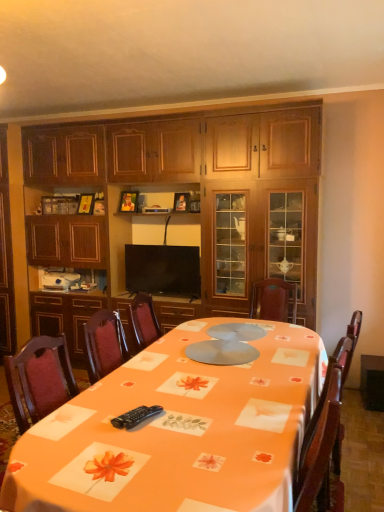
This screenshot has height=512, width=384. Identify the location of orange fabric table at center. (179, 429).

Where is `wooden cabinet at center`? Image resolution: width=384 pixels, height=512 pixels. wooden cabinet at center is located at coordinates (210, 186).

Does black plastic remote control at lower center have a smaller size compared to flat screen tv at center?

Correct, black plastic remote control at lower center occupies less space than flat screen tv at center.

From a real-world perspective, between black plastic remote control at lower center and flat screen tv at center, who is vertically higher?

flat screen tv at center.

Between black plastic remote control at lower center and flat screen tv at center, which one appears on the right side from the viewer's perspective?

From the viewer's perspective, black plastic remote control at lower center appears more on the right side.

Measure the distance from black plastic remote control at lower center to flat screen tv at center.

black plastic remote control at lower center is 7.05 feet away from flat screen tv at center.

Can you confirm if orange fabric table at center is thinner than wooden cabinet at center?

No.

From a real-world perspective, is orange fabric table at center under wooden cabinet at center?

Yes, from a real-world perspective, orange fabric table at center is under wooden cabinet at center.

From the image's perspective, which one is positioned higher, orange fabric table at center or wooden cabinet at center?

wooden cabinet at center is shown above in the image.

Is the depth of black plastic remote control at lower center greater than that of orange fabric table at center?

Yes, black plastic remote control at lower center is further from the camera.

Can orange fabric table at center be found inside black plastic remote control at lower center?

No, black plastic remote control at lower center does not contain orange fabric table at center.

Considering the sizes of black plastic remote control at lower center and orange fabric table at center in the image, is black plastic remote control at lower center taller or shorter than orange fabric table at center?

Considering their sizes, black plastic remote control at lower center has less height than orange fabric table at center.

From the image's perspective, which one is positioned lower, wooden cabinet at center or black plastic remote control at lower center?

black plastic remote control at lower center is shown below in the image.

Would you say wooden cabinet at center is a long distance from black plastic remote control at lower center?

wooden cabinet at center is far away from black plastic remote control at lower center.

From a real-world perspective, is wooden cabinet at center physically located above or below black plastic remote control at lower center?

From a real-world perspective, wooden cabinet at center is physically above black plastic remote control at lower center.

Considering the relative sizes of wooden cabinet at center and black plastic remote control at lower center in the image provided, is wooden cabinet at center wider than black plastic remote control at lower center?

Yes, wooden cabinet at center is wider than black plastic remote control at lower center.

Is black plastic remote control at lower center directly adjacent to wooden cabinet at center?

No, black plastic remote control at lower center is not next to wooden cabinet at center.

From a real-world perspective, between black plastic remote control at lower center and wooden cabinet at center, who is vertically higher?

wooden cabinet at center, from a real-world perspective.

Which object is wider, black plastic remote control at lower center or wooden cabinet at center?

wooden cabinet at center is wider.

Which object is positioned more to the right, black plastic remote control at lower center or wooden cabinet at center?

black plastic remote control at lower center.

Is point (245, 204) farther from viewer compared to point (188, 272)?

No, (245, 204) is in front of (188, 272).

Does wooden cabinet at center have a lesser height compared to flat screen tv at center?

No, wooden cabinet at center is not shorter than flat screen tv at center.

Would you consider wooden cabinet at center to be distant from flat screen tv at center?

No, wooden cabinet at center is not far away from flat screen tv at center.

From the image's perspective, which is below, wooden cabinet at center or flat screen tv at center?

flat screen tv at center is shown below in the image.

How many degrees apart are the facing directions of flat screen tv at center and orange fabric table at center?

86.6 degrees separate the facing orientations of flat screen tv at center and orange fabric table at center.

Between flat screen tv at center and orange fabric table at center, which one has larger width?

Wider between the two is orange fabric table at center.

Is flat screen tv at center smaller than orange fabric table at center?

Yes.

Which object is positioned more to the right, flat screen tv at center or orange fabric table at center?

Positioned to the right is orange fabric table at center.

Identify the location of remote control in front of the flat screen tv at center. The image size is (384, 512). (135, 416).

Identify the location of round table below the wooden cabinet at center (from a real-world perspective). pyautogui.click(x=179, y=429).

Based on their spatial positions, is black plastic remote control at lower center or flat screen tv at center closer to orange fabric table at center?

The object closer to orange fabric table at center is black plastic remote control at lower center.

Estimate the real-world distances between objects in this image. Which object is closer to flat screen tv at center, orange fabric table at center or wooden cabinet at center?

The object closer to flat screen tv at center is wooden cabinet at center.

When comparing their distances from orange fabric table at center, does flat screen tv at center or black plastic remote control at lower center seem closer?

black plastic remote control at lower center.

From the image, which object appears to be farther from black plastic remote control at lower center, wooden cabinet at center or orange fabric table at center?

The object further to black plastic remote control at lower center is wooden cabinet at center.

Which object lies nearer to the anchor point flat screen tv at center, orange fabric table at center or black plastic remote control at lower center?

Among the two, orange fabric table at center is located nearer to flat screen tv at center.

When comparing their distances from black plastic remote control at lower center, does orange fabric table at center or flat screen tv at center seem closer?

The object closer to black plastic remote control at lower center is orange fabric table at center.

When comparing their distances from orange fabric table at center, does wooden cabinet at center or black plastic remote control at lower center seem further?

wooden cabinet at center.

Looking at the image, which one is located further to wooden cabinet at center, flat screen tv at center or black plastic remote control at lower center?

black plastic remote control at lower center is further to wooden cabinet at center.

Find the location of a particular element. Image resolution: width=384 pixels, height=512 pixels. remote control positioned between orange fabric table at center and flat screen tv at center from near to far is located at coordinates (135, 416).

The image size is (384, 512). Find the location of `remote control positioned between orange fabric table at center and wooden cabinet at center from near to far`. remote control positioned between orange fabric table at center and wooden cabinet at center from near to far is located at coordinates (135, 416).

Locate an element on the screen. This screenshot has width=384, height=512. cabinetry located between orange fabric table at center and flat screen tv at center in the depth direction is located at coordinates (210, 186).

The image size is (384, 512). Find the location of `cabinetry between black plastic remote control at lower center and flat screen tv at center from front to back`. cabinetry between black plastic remote control at lower center and flat screen tv at center from front to back is located at coordinates coord(210,186).